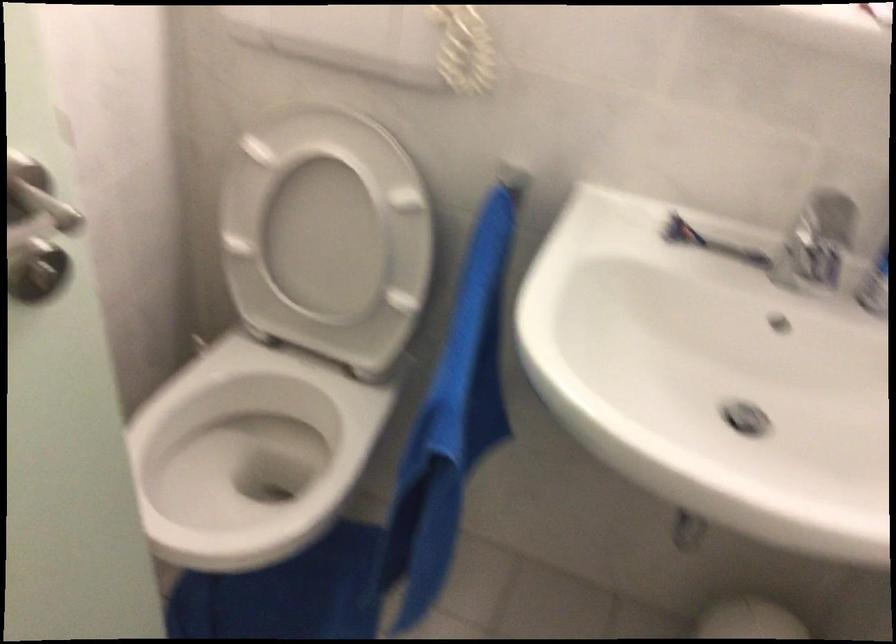
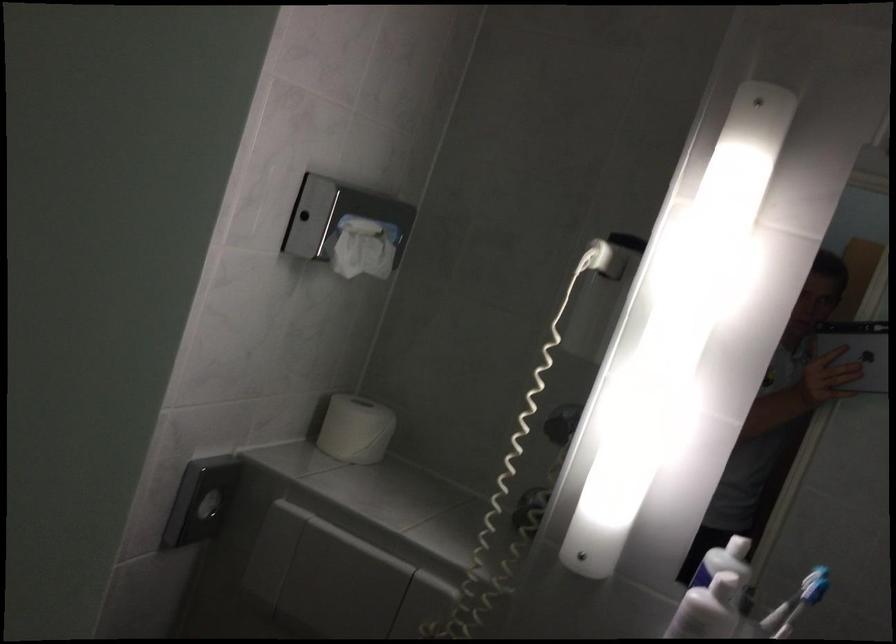
Question: The images are taken continuously from a first-person perspective. In which direction is your viewpoint rotating?

Choices:
 (A) Left
 (B) Right
 (C) Up
 (D) Down

Answer: (C)